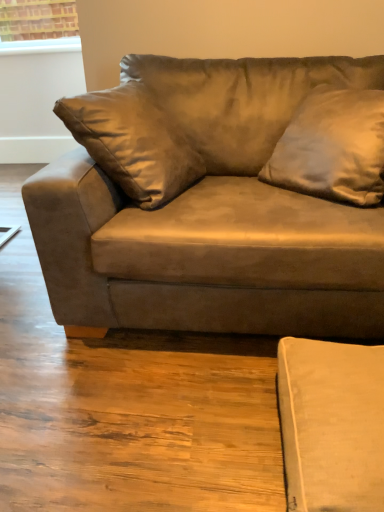
From the picture: In order to face suede-like brown couch at center, should I rotate leftwards or rightwards?

Turn right by 7.166 degrees to look at suede-like brown couch at center.

Where is `suede-like brown couch at center`? suede-like brown couch at center is located at coordinates (215, 216).

What do you see at coordinates (215, 216) in the screenshot? I see `suede-like brown couch at center` at bounding box center [215, 216].

Describe the element at coordinates (333, 147) in the screenshot. I see `satin brown pillow at upper right` at that location.

Where is `satin brown pillow at upper right`? satin brown pillow at upper right is located at coordinates pyautogui.click(x=333, y=147).

Locate an element on the screen. The image size is (384, 512). suede-like brown couch at center is located at coordinates (215, 216).

Looking at this image, does satin brown pillow at upper right appear on the left side of suede-like brown couch at center?

No, satin brown pillow at upper right is not to the left of suede-like brown couch at center.

Is the depth of satin brown pillow at upper right greater than that of suede-like brown couch at center?

Yes, satin brown pillow at upper right is behind suede-like brown couch at center.

Which is closer to the camera, (x=312, y=98) or (x=228, y=231)?

The point (x=228, y=231) is closer to the camera.

From the image's perspective, does satin brown pillow at upper right appear lower than suede-like brown couch at center?

Incorrect, from the image's perspective, satin brown pillow at upper right is higher than suede-like brown couch at center.

From a real-world perspective, which is physically below, satin brown pillow at upper right or suede-like brown couch at center?

suede-like brown couch at center, from a real-world perspective.

In terms of width, does satin brown pillow at upper right look wider or thinner when compared to suede-like brown couch at center?

Considering their sizes, satin brown pillow at upper right looks slimmer than suede-like brown couch at center.

Which of these two, satin brown pillow at upper right or suede-like brown couch at center, stands shorter?

With less height is satin brown pillow at upper right.

Which of these two, satin brown pillow at upper right or suede-like brown couch at center, is bigger?

Bigger between the two is suede-like brown couch at center.

Do you think satin brown pillow at upper right is within suede-like brown couch at center, or outside of it?

satin brown pillow at upper right is contained in suede-like brown couch at center.

Is satin brown pillow at upper right touching suede-like brown couch at center?

They are not placed beside each other.

Could you tell me if satin brown pillow at upper right is facing suede-like brown couch at center?

Yes, satin brown pillow at upper right is turned towards suede-like brown couch at center.

What's the angular difference between satin brown pillow at upper right and suede-like brown couch at center's facing directions?

44.8 degrees.

Looking at this image, measure the distance from satin brown pillow at upper right to suede-like brown couch at center.

satin brown pillow at upper right is 11.84 inches from suede-like brown couch at center.

In the image, there is a suede-like brown couch at center. Where is `pillow above it (from the image's perspective)`? pillow above it (from the image's perspective) is located at coordinates (333, 147).

From the picture: Which object is positioned more to the left, suede-like brown couch at center or satin brown pillow at upper right?

suede-like brown couch at center is more to the left.

Which is behind, suede-like brown couch at center or satin brown pillow at upper right?

satin brown pillow at upper right is behind.

Considering the positions of point (126, 229) and point (294, 182), is point (126, 229) closer or farther from the camera than point (294, 182)?

Clearly, point (126, 229) is closer to the camera than point (294, 182).

From the image's perspective, would you say suede-like brown couch at center is positioned over satin brown pillow at upper right?

No, from the image's perspective, suede-like brown couch at center is not over satin brown pillow at upper right.

From a real-world perspective, is suede-like brown couch at center located beneath satin brown pillow at upper right?

Yes.

Is suede-like brown couch at center thinner than satin brown pillow at upper right?

No.

Considering the sizes of suede-like brown couch at center and satin brown pillow at upper right in the image, is suede-like brown couch at center taller or shorter than satin brown pillow at upper right?

Considering their sizes, suede-like brown couch at center has more height than satin brown pillow at upper right.

In the scene shown: Considering the relative sizes of suede-like brown couch at center and satin brown pillow at upper right in the image provided, is suede-like brown couch at center bigger than satin brown pillow at upper right?

Correct, suede-like brown couch at center is larger in size than satin brown pillow at upper right.

Choose the correct answer: Is suede-like brown couch at center inside satin brown pillow at upper right or outside it?

suede-like brown couch at center is located beyond the bounds of satin brown pillow at upper right.

Are suede-like brown couch at center and satin brown pillow at upper right located far from each other?

No, suede-like brown couch at center is not far from satin brown pillow at upper right.

Does suede-like brown couch at center turn towards satin brown pillow at upper right?

Yes, suede-like brown couch at center is turned towards satin brown pillow at upper right.

What's the angular difference between suede-like brown couch at center and satin brown pillow at upper right's facing directions?

The angle between the facing direction of suede-like brown couch at center and the facing direction of satin brown pillow at upper right is 44.8 degrees.

Where is `studio couch in front of the satin brown pillow at upper right`? studio couch in front of the satin brown pillow at upper right is located at coordinates (215, 216).

Identify the location of studio couch below the satin brown pillow at upper right (from a real-world perspective). The width and height of the screenshot is (384, 512). (215, 216).

Identify the location of pillow that appears behind the suede-like brown couch at center. This screenshot has width=384, height=512. (333, 147).